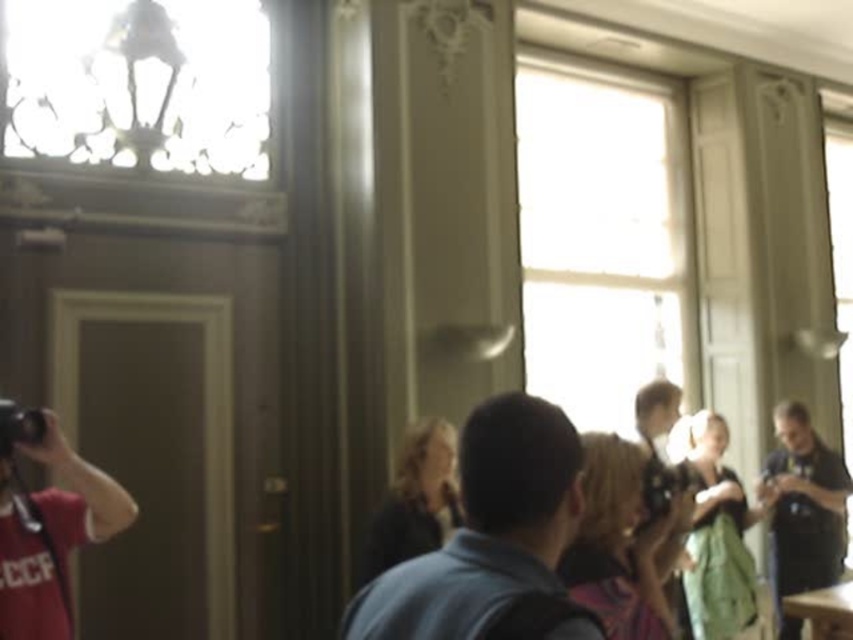
Based on the photo, you are standing in the room and want to take a photo of the dark blue shirt at center. Based on its position, where should you aim your camera?

The dark blue shirt at center is located at point 0.828 on the x axis and 0.571 on the y axis, so you should aim your camera towards those coordinates to capture it.

You are a photographer in the room and want to ensure that both the multicolored fabric bag at center and the green fabric dress at center are visible in your photo. Based on their positions, which one should you focus on first to ensure both are in frame?

The multicolored fabric bag at center is above the green fabric dress at center, so you should focus on the green fabric dress at center first to ensure both are in frame.